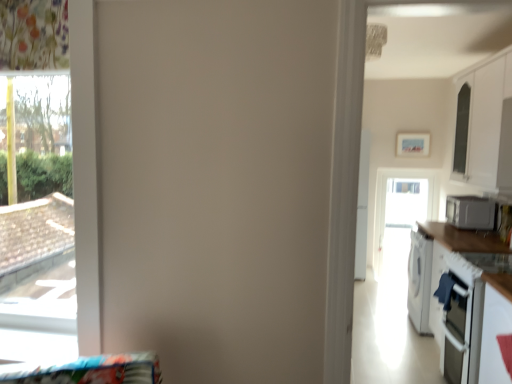
Question: Considering the relative sizes of transparent glass window at left and satin silver microwave at right in the image provided, is transparent glass window at left smaller than satin silver microwave at right?

Choices:
 (A) no
 (B) yes

Answer: (A)

Question: Is transparent glass window at left in front of satin silver microwave at right?

Choices:
 (A) no
 (B) yes

Answer: (B)

Question: Can you confirm if transparent glass window at left is thinner than satin silver microwave at right?

Choices:
 (A) yes
 (B) no

Answer: (A)

Question: Is transparent glass window at left completely or partially outside of satin silver microwave at right?

Choices:
 (A) yes
 (B) no

Answer: (A)

Question: Does transparent glass window at left have a lesser height compared to satin silver microwave at right?

Choices:
 (A) no
 (B) yes

Answer: (A)

Question: Is satin silver microwave at right to the left or to the right of white glossy cabinet at upper right in the image?

Choices:
 (A) left
 (B) right

Answer: (B)

Question: Is satin silver microwave at right bigger or smaller than white glossy cabinet at upper right?

Choices:
 (A) big
 (B) small

Answer: (B)

Question: Do you think satin silver microwave at right is within white glossy cabinet at upper right, or outside of it?

Choices:
 (A) outside
 (B) inside

Answer: (A)

Question: From the image's perspective, is satin silver microwave at right above or below white glossy cabinet at upper right?

Choices:
 (A) above
 (B) below

Answer: (B)

Question: Do you think transparent glass window at left is within white glossy countertop at right, or outside of it?

Choices:
 (A) outside
 (B) inside

Answer: (A)

Question: From the image's perspective, is transparent glass window at left positioned above or below white glossy countertop at right?

Choices:
 (A) above
 (B) below

Answer: (A)

Question: Does point (32, 127) appear closer or farther from the camera than point (505, 329)?

Choices:
 (A) closer
 (B) farther

Answer: (A)

Question: In the image, is transparent glass window at left on the left side or the right side of white glossy countertop at right?

Choices:
 (A) right
 (B) left

Answer: (B)

Question: In terms of width, does white glossy countertop at right look wider or thinner when compared to transparent glass window at left?

Choices:
 (A) wide
 (B) thin

Answer: (A)

Question: Based on their sizes in the image, would you say white glossy countertop at right is bigger or smaller than transparent glass window at left?

Choices:
 (A) big
 (B) small

Answer: (A)